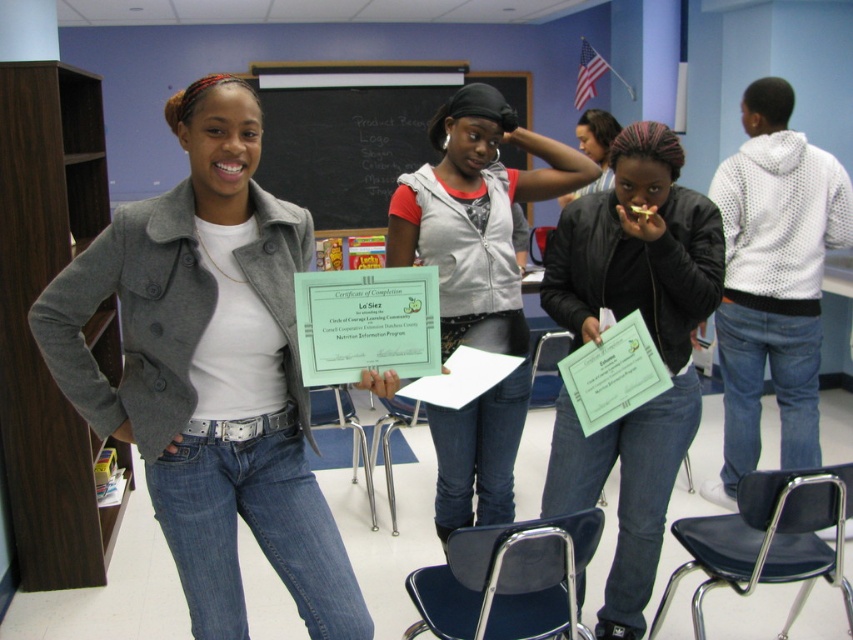
Question: Is white dotted hoodie at right to the left of matte black jacket at center from the viewer's perspective?

Choices:
 (A) no
 (B) yes

Answer: (A)

Question: Which point is farther to the camera?

Choices:
 (A) matte gray hoodie at center
 (B) black leather jacket at center
 (C) green paper certificate at center
 (D) white dotted hoodie at right

Answer: (D)

Question: Which object is the closest to the white dotted hoodie at right?

Choices:
 (A) black leather jacket at center
 (B) matte gray jacket at center

Answer: (A)

Question: Does matte gray hoodie at center appear on the left side of green paper certificate at center?

Choices:
 (A) yes
 (B) no

Answer: (B)

Question: Which of these objects is positioned farthest from the matte gray hoodie at center?

Choices:
 (A) matte gray jacket at center
 (B) black leather jacket at center
 (C) green paper certificate at center

Answer: (A)

Question: Is matte gray jacket at center bigger than black leather jacket at center?

Choices:
 (A) no
 (B) yes

Answer: (B)